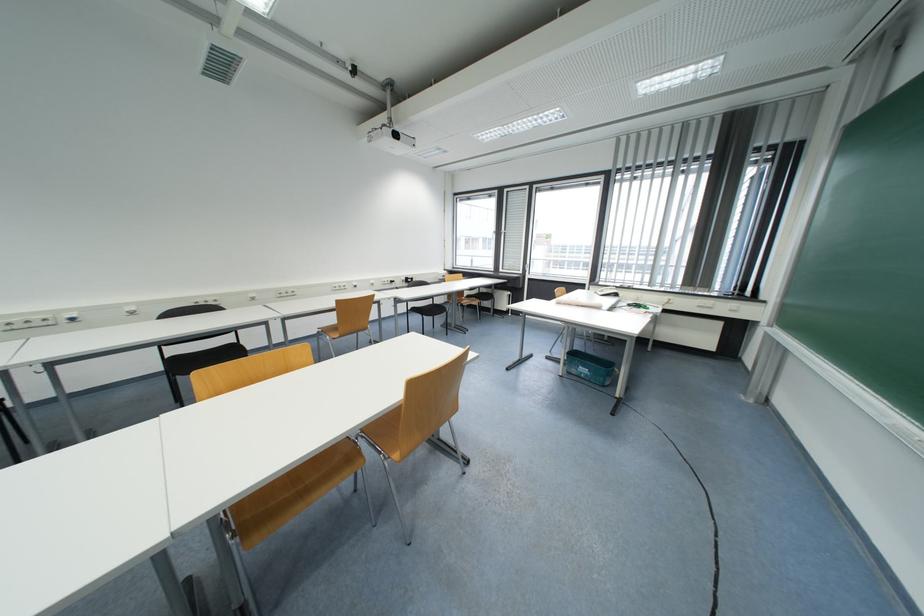
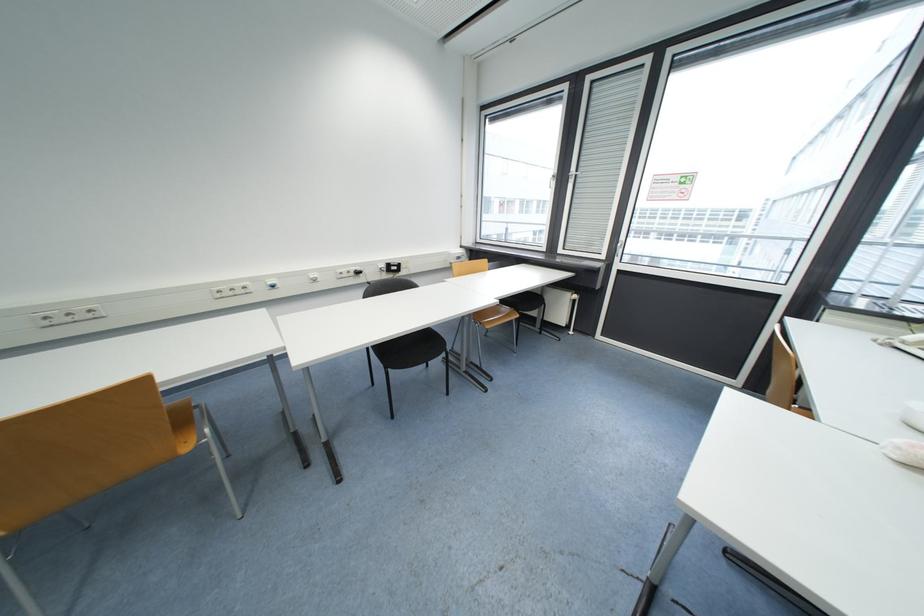
Question: Which direction would the cameraman need to move to produce the second image? Reply with the corresponding letter.

Choices:
 (A) Left
 (B) Right
 (C) Forward
 (D) Backward

Answer: (C)